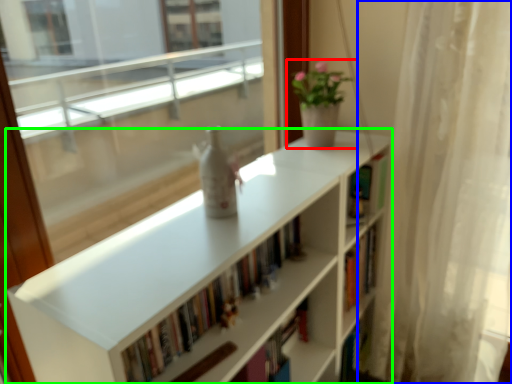
Question: Considering the real-world distances, which object is closest to houseplant (highlighted by a red box)? curtain (highlighted by a blue box) or bookcase (highlighted by a green box).

Choices:
 (A) curtain
 (B) bookcase

Answer: (B)